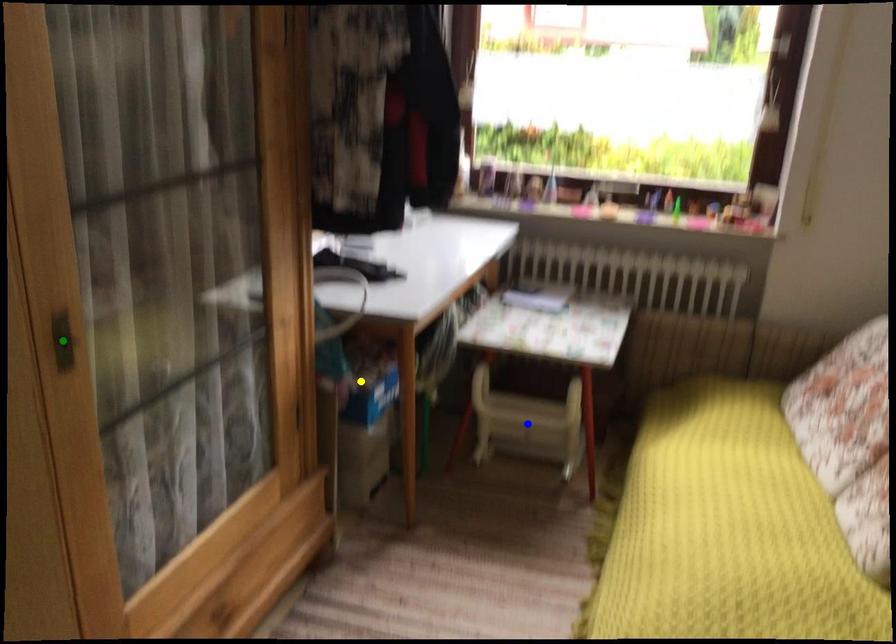
Order these from nearest to farthest:
A) yellow point
B) green point
C) blue point

green point → yellow point → blue point